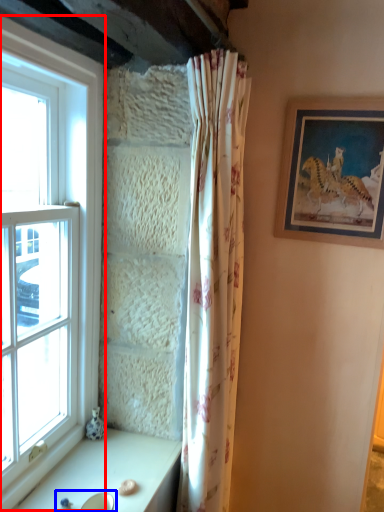
Question: Which object appears closest to the camera in this image, window (highlighted by a red box) or sink (highlighted by a blue box)?

Choices:
 (A) window
 (B) sink

Answer: (A)